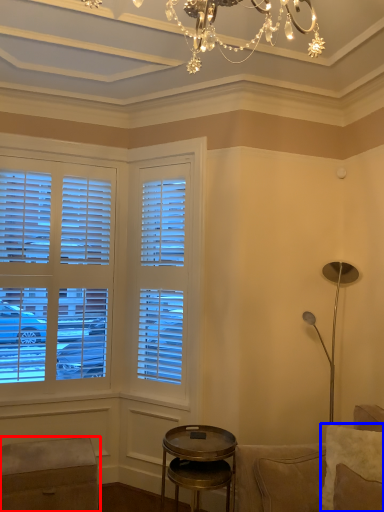
Question: Which point is closer to the camera, music stool (highlighted by a red box) or pillow (highlighted by a blue box)?

Choices:
 (A) music stool
 (B) pillow

Answer: (B)